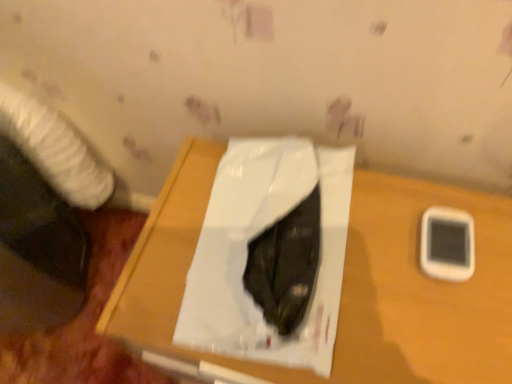
I want to click on unoccupied region to the right of white glossy paper at center, so click(x=411, y=266).